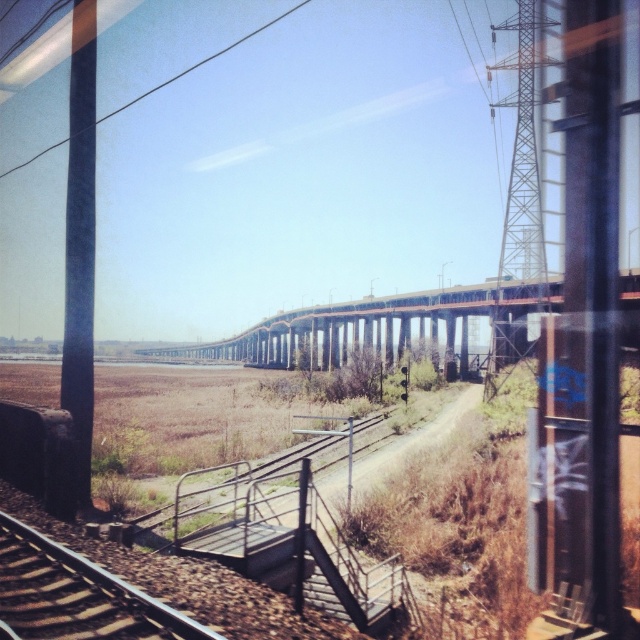
Question: Is the position of brown gravel train track at lower left more distant than that of black wire at upper center?

Choices:
 (A) no
 (B) yes

Answer: (A)

Question: Which is nearer to the rusty steel bridge at center?

Choices:
 (A) brown gravel train track at lower left
 (B) black wire at upper center

Answer: (A)

Question: Which point appears closest to the camera in this image?

Choices:
 (A) (116, 109)
 (B) (44, 548)
 (C) (422, 316)

Answer: (B)

Question: Based on their relative distances, which object is farther from the rusty steel bridge at center?

Choices:
 (A) black wire at upper center
 (B) brown gravel train track at lower left

Answer: (A)

Question: Does rusty steel bridge at center come in front of brown gravel train track at lower left?

Choices:
 (A) no
 (B) yes

Answer: (B)

Question: Does brown gravel train track at lower left appear on the left side of black wire at upper center?

Choices:
 (A) no
 (B) yes

Answer: (A)